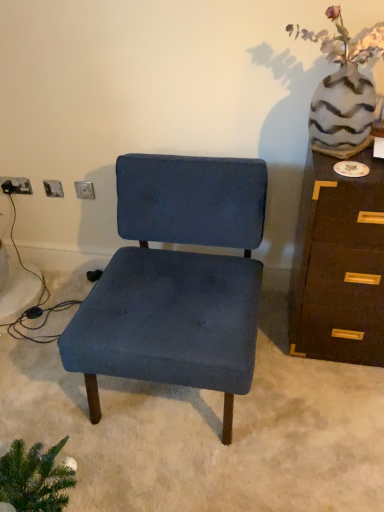
Locate an element on the screen. vacant area that is in front of brown wood chest of drawers at right is located at coordinates (331, 408).